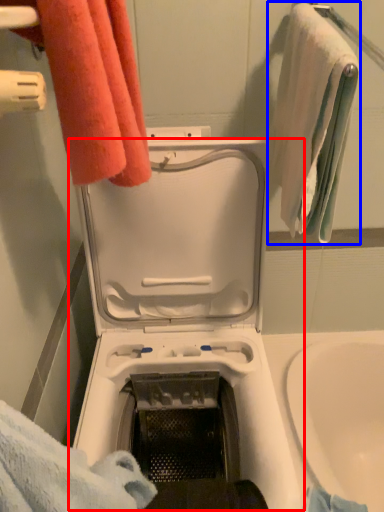
Question: Which of the following is the farthest to the observer, washing machine (highlighted by a red box) or towel (highlighted by a blue box)?

Choices:
 (A) washing machine
 (B) towel

Answer: (B)